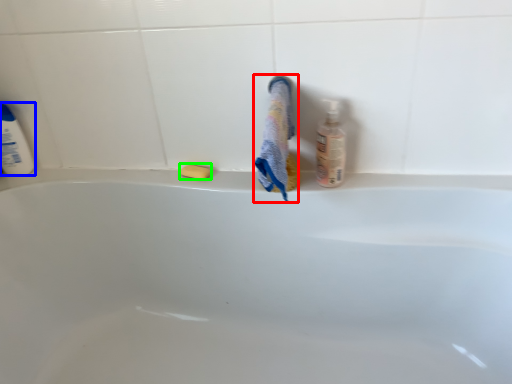
Question: Which is farther away from bath towel (highlighted by a red box)? cleaning product (highlighted by a blue box) or soap (highlighted by a green box)?

Choices:
 (A) cleaning product
 (B) soap

Answer: (A)